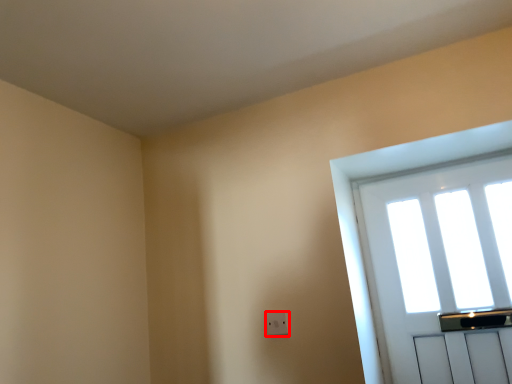
Question: From the image's perspective, where is electric outlet (annotated by the red box) located relative to window?

Choices:
 (A) above
 (B) below

Answer: (B)